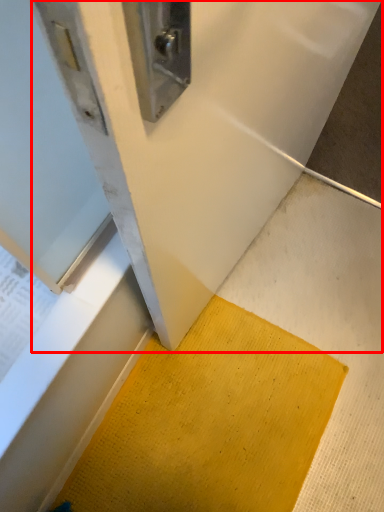
Question: From the image's perspective, what is the correct spatial positioning of wide (annotated by the red box) in reference to doormat?

Choices:
 (A) below
 (B) above

Answer: (B)